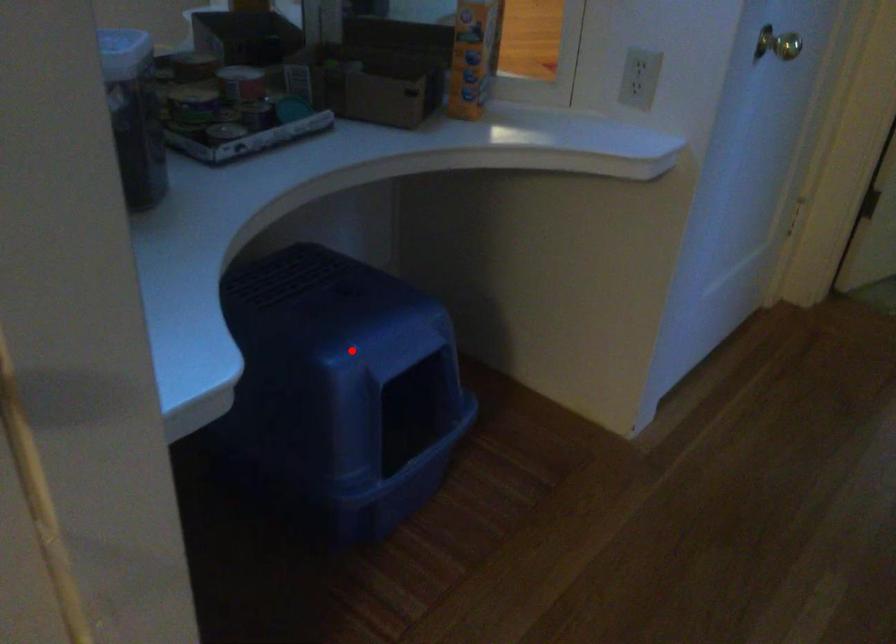
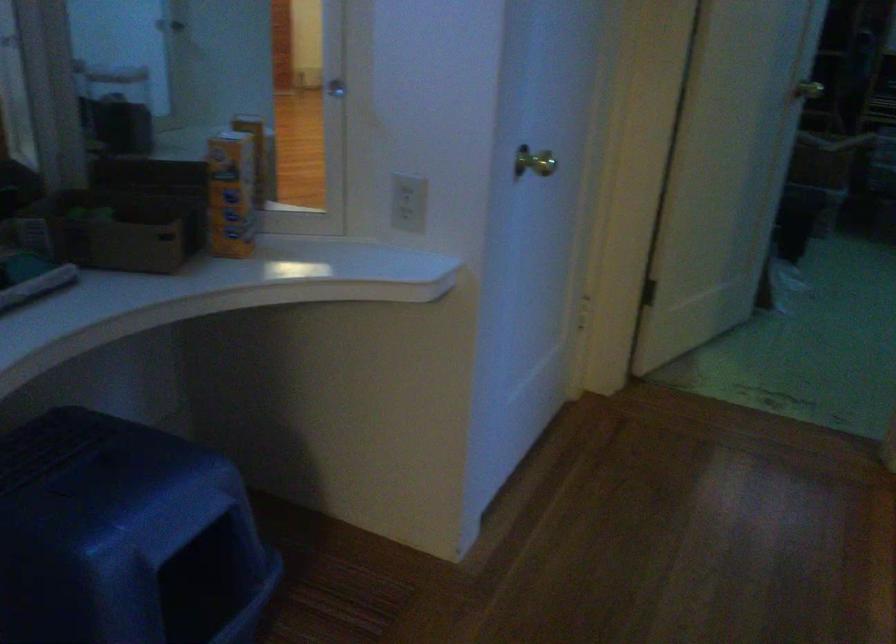
Question: I am providing you with two images of the same scene from different viewpoints. Image1 has a red point marked. In image2, the corresponding 3D location appears at what relative position? Reply with the corresponding letter.

Choices:
 (A) Closer
 (B) Farther

Answer: (A)